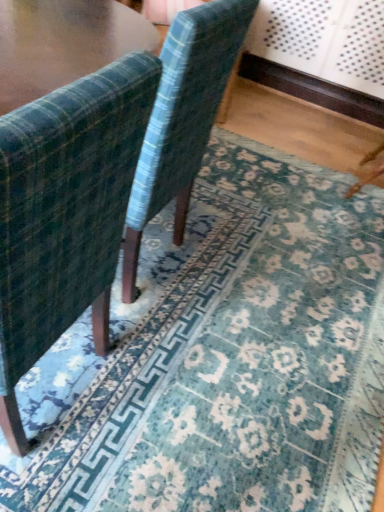
Question: Is velvet green chair at left, the first chair viewed from the front, taller or shorter than velvet-like green chair at center, which is the 1th chair from back to front?

Choices:
 (A) short
 (B) tall

Answer: (B)

Question: From a real-world perspective, is velvet green chair at left, which is counted as the 2th chair, starting from the back, physically located above or below velvet-like green chair at center, positioned as the 2th chair in front-to-back order?

Choices:
 (A) below
 (B) above

Answer: (B)

Question: From the image's perspective, is velvet green chair at left, which is counted as the 2th chair, starting from the back, located above or below velvet-like green chair at center, positioned as the 2th chair in front-to-back order?

Choices:
 (A) below
 (B) above

Answer: (A)

Question: Would you say velvet-like green chair at center, which is the 1th chair from back to front, is to the left or to the right of velvet green chair at left, the first chair viewed from the front, in the picture?

Choices:
 (A) left
 (B) right

Answer: (B)

Question: Considering their positions, is velvet-like green chair at center, which is the 1th chair from back to front, located in front of or behind velvet green chair at left, which is counted as the 2th chair, starting from the back?

Choices:
 (A) behind
 (B) front

Answer: (A)

Question: Considering the positions of velvet-like green chair at center, which is the 1th chair from back to front, and velvet green chair at left, the first chair viewed from the front, in the image, is velvet-like green chair at center, which is the 1th chair from back to front, wider or thinner than velvet green chair at left, the first chair viewed from the front,?

Choices:
 (A) wide
 (B) thin

Answer: (B)

Question: Considering the positions of velvet-like green chair at center, positioned as the 2th chair in front-to-back order, and velvet green chair at left, the first chair viewed from the front, in the image, is velvet-like green chair at center, positioned as the 2th chair in front-to-back order, bigger or smaller than velvet green chair at left, the first chair viewed from the front,?

Choices:
 (A) small
 (B) big

Answer: (B)